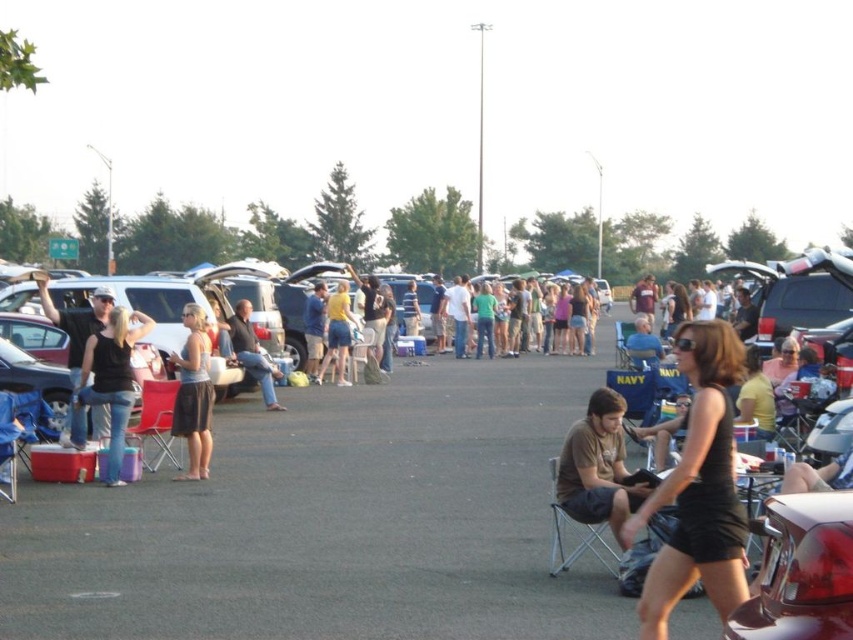
Who is higher up, shiny red tail light at lower right or matte red folding chair at lower left?

Positioned higher is shiny red tail light at lower right.

Who is more distant from viewer, (843,570) or (143,385)?

The point (143,385) is behind.

This screenshot has height=640, width=853. I want to click on shiny red tail light at lower right, so click(799, 570).

Measure the distance from black matte dress at center to brown cotton shirt at center.

black matte dress at center is 1.56 meters away from brown cotton shirt at center.

Which is more to the left, black matte dress at center or brown cotton shirt at center?

brown cotton shirt at center

Does point (704, 355) come behind point (587, 404)?

No, (704, 355) is in front of (587, 404).

This screenshot has height=640, width=853. In order to click on black matte dress at center in this screenshot , I will do `click(698, 486)`.

Does brown cotton shirt at center have a greater height compared to matte black tank top at left?

In fact, brown cotton shirt at center may be shorter than matte black tank top at left.

How much distance is there between brown cotton shirt at center and matte black tank top at left?

Result: brown cotton shirt at center and matte black tank top at left are 5.34 meters apart.

Is point (589, 474) farther from viewer compared to point (97, 340)?

No.

Where is `brown cotton shirt at center`? The height and width of the screenshot is (640, 853). brown cotton shirt at center is located at coordinates (598, 467).